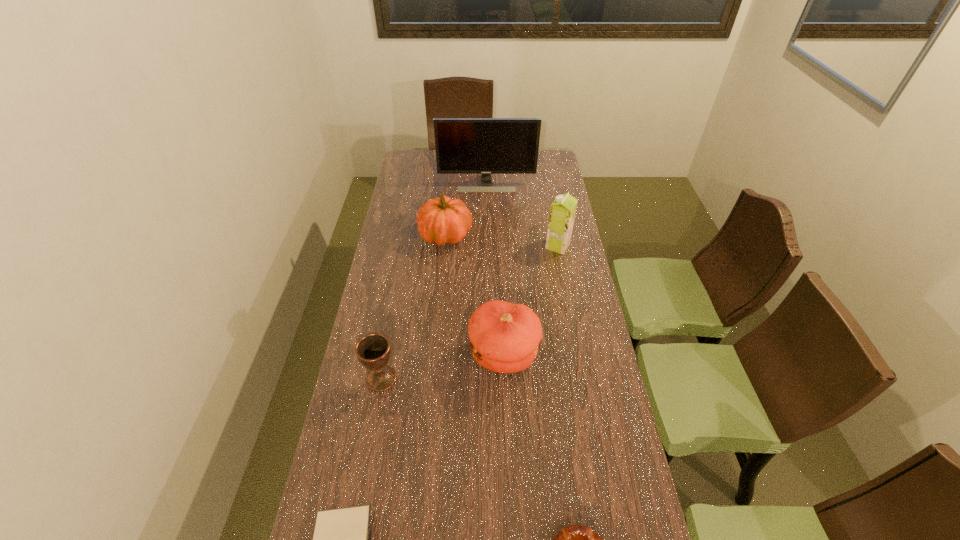
This screenshot has width=960, height=540. I want to click on monitor, so click(486, 146).

You are a GUI agent. You are given a task and a screenshot of the screen. Output one action in this format:
    pyautogui.click(x=<x>, y=<y>)
    Task: Click on the tallest object
    This screenshot has height=540, width=960.
    Given the screenshot: What is the action you would take?
    pyautogui.click(x=486, y=146)

This screenshot has width=960, height=540. I want to click on soya milk, so (x=562, y=213).

Locate an element on the screen. the farther pumpkin is located at coordinates (442, 220).

What are the coordinates of `the nearer pumpkin` in the screenshot? It's located at (504, 337).

Find the location of a particular element. the fifth tallest object is located at coordinates (373, 350).

This screenshot has width=960, height=540. Find the location of `blank space located on the screen side of the monitor`. blank space located on the screen side of the monitor is located at coordinates (488, 227).

Where is `vacant region located on the front of the soya milk`? vacant region located on the front of the soya milk is located at coordinates (565, 285).

Locate an element on the screen. The width and height of the screenshot is (960, 540). free space located 0.080m on the left of the farther pumpkin is located at coordinates (399, 235).

This screenshot has height=540, width=960. In order to click on vacant region located on the back of the nearer pumpkin in this screenshot , I will do `click(501, 298)`.